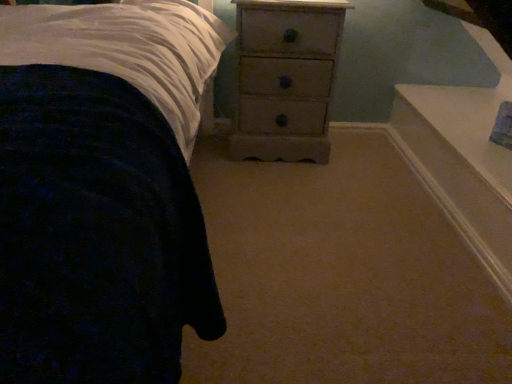
Image resolution: width=512 pixels, height=384 pixels. What are the coordinates of `free spot to the right of light brown wooden chest of drawers at center` in the screenshot? It's located at (365, 172).